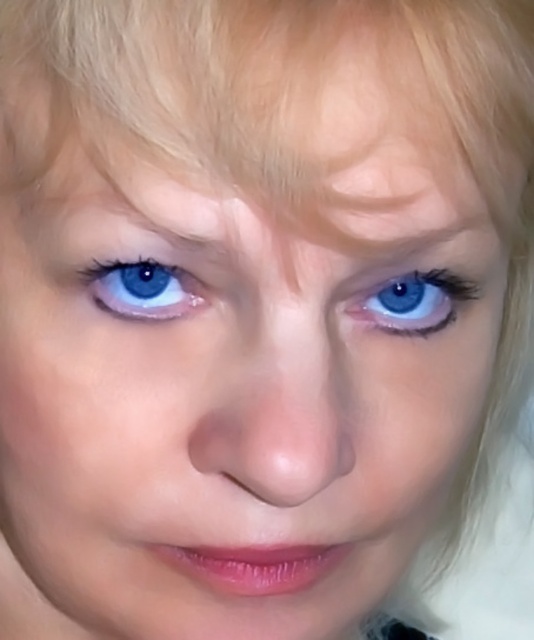
Question: Can you confirm if blue glossy eye at center is positioned to the left of blue glossy eye at upper left?

Choices:
 (A) yes
 (B) no

Answer: (B)

Question: Is blue glossy eye at center positioned behind blue glossy eye at upper left?

Choices:
 (A) yes
 (B) no

Answer: (A)

Question: Among these objects, which one is nearest to the camera?

Choices:
 (A) blue glossy eye at upper left
 (B) blue glossy eye at center

Answer: (A)

Question: Which point is closer to the camera taking this photo?

Choices:
 (A) pos(96,291)
 (B) pos(402,275)

Answer: (A)

Question: Is blue glossy eye at center in front of blue glossy eye at upper left?

Choices:
 (A) no
 (B) yes

Answer: (A)